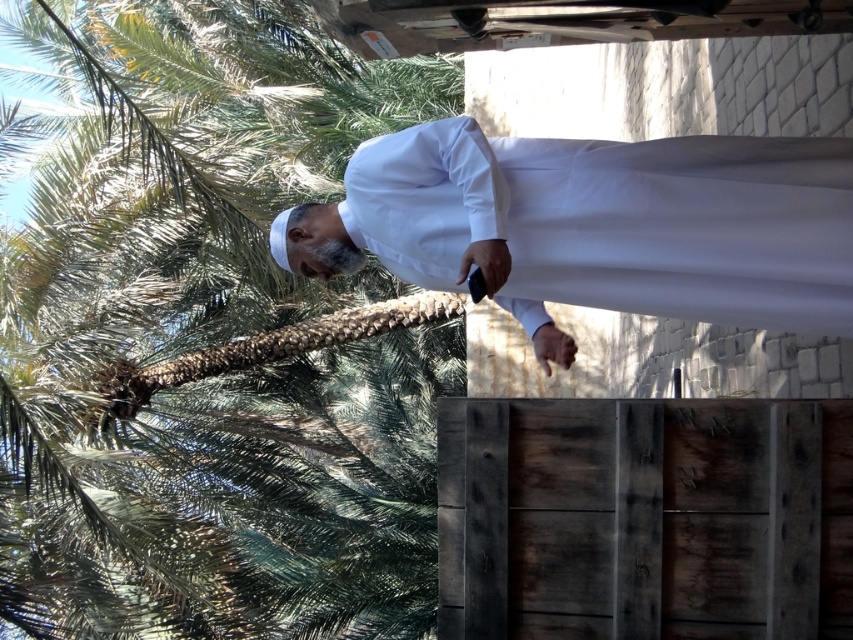
Question: Among these points, which one is nearest to the camera?

Choices:
 (A) (809, 173)
 (B) (212, 42)

Answer: (A)

Question: Observing the image, what is the correct spatial positioning of green leafy palm tree at upper left in reference to white matte/soft fabric at center?

Choices:
 (A) above
 (B) below

Answer: (B)

Question: Does green leafy palm tree at upper left have a greater width compared to white matte/soft fabric at center?

Choices:
 (A) no
 (B) yes

Answer: (A)

Question: Is green leafy palm tree at upper left closer to camera compared to white matte/soft fabric at center?

Choices:
 (A) no
 (B) yes

Answer: (A)